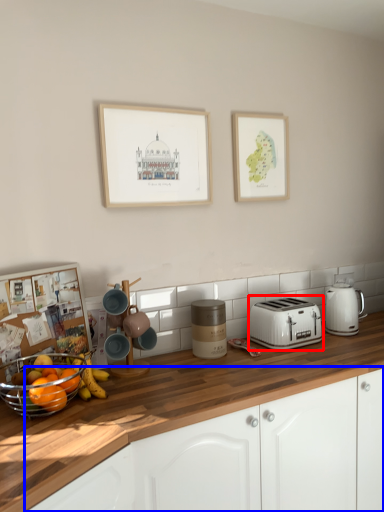
Question: Which point is further to the camera, toaster (highlighted by a red box) or cabinetry (highlighted by a blue box)?

Choices:
 (A) toaster
 (B) cabinetry

Answer: (A)